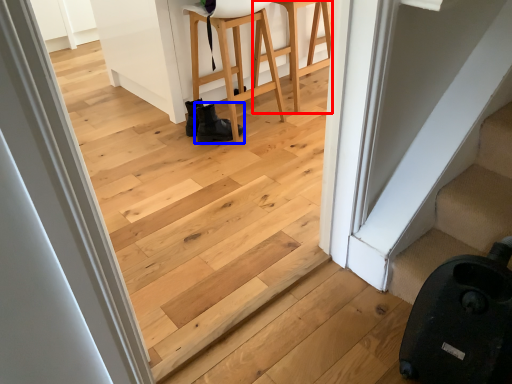
Question: Which point is further to the camera, furniture (highlighted by a red box) or footwear (highlighted by a blue box)?

Choices:
 (A) furniture
 (B) footwear

Answer: (B)